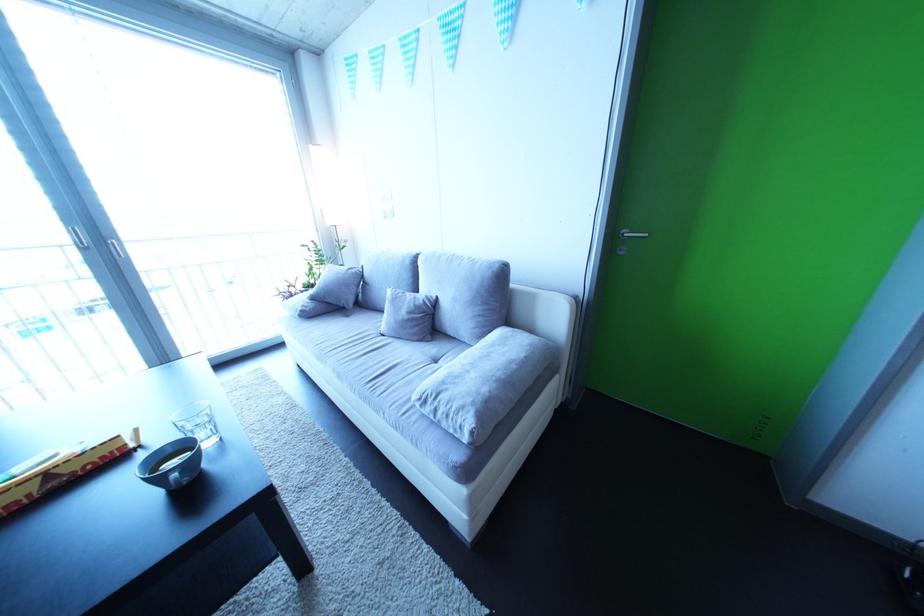
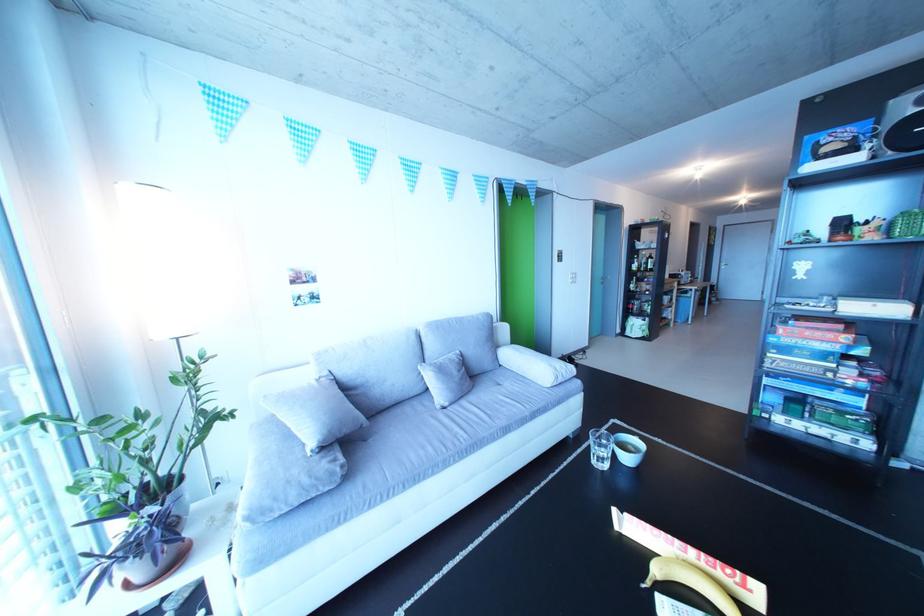
In the second image, find the point that corresponds to the point at 342,306 in the first image.

(359, 437)